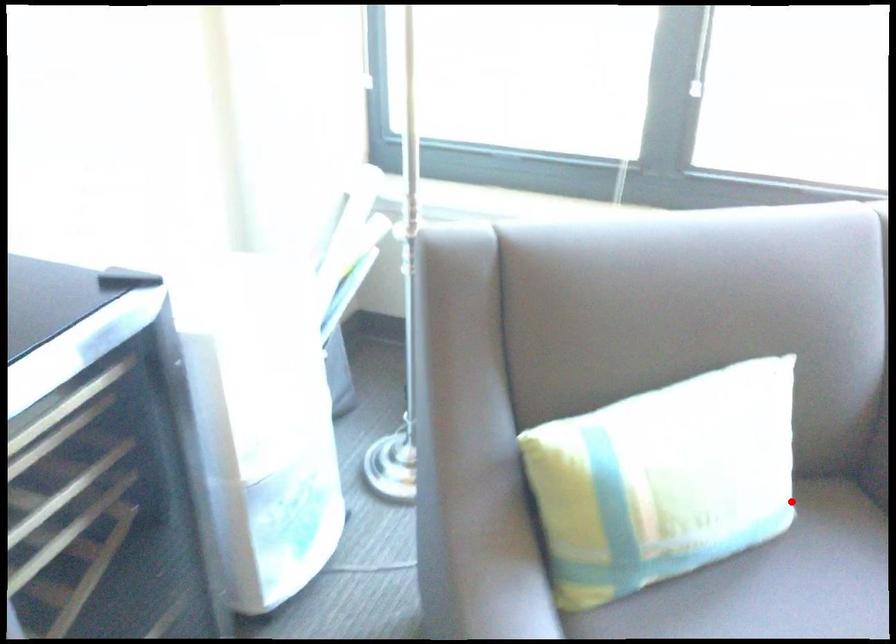
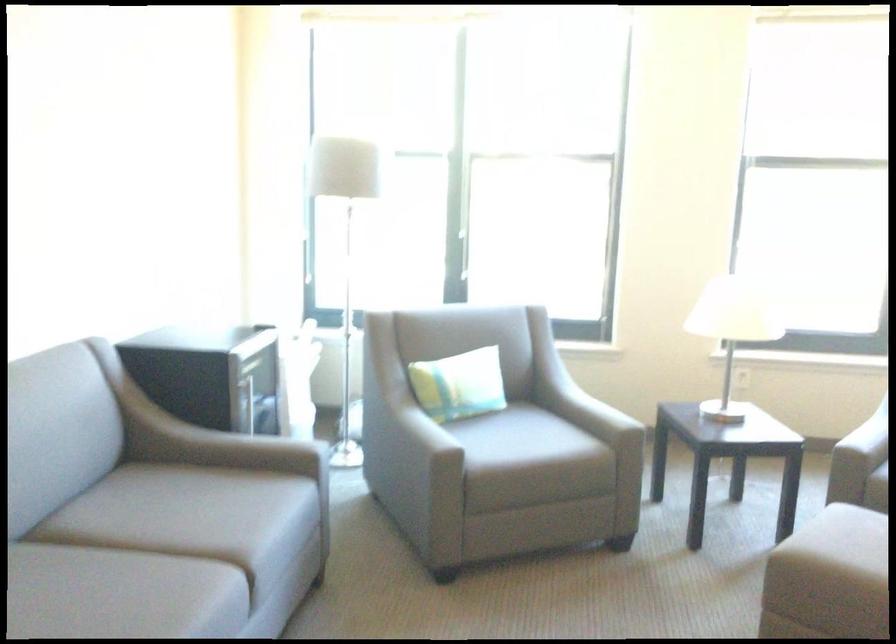
Find the pixel in the second image that matches the highlighted location in the first image.

(459, 384)